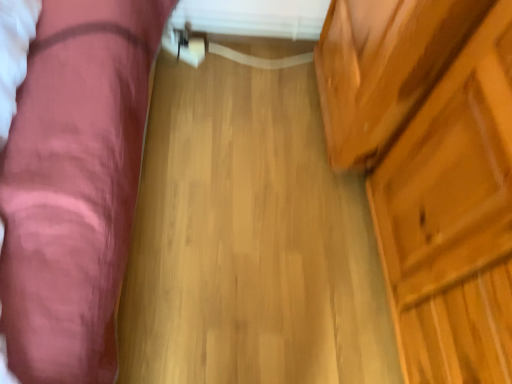
Question: Is point (292, 304) positioned closer to the camera than point (477, 130)?

Choices:
 (A) farther
 (B) closer

Answer: (A)

Question: From a real-world perspective, is natural wood floor at center positioned above or below wooden dresser at right?

Choices:
 (A) below
 (B) above

Answer: (A)

Question: Considering the real-world distances, which object is closest to the natural wood floor at center?

Choices:
 (A) wooden dresser at right
 (B) velvet pink couch at left

Answer: (A)

Question: Which of these objects is positioned farthest from the wooden dresser at right?

Choices:
 (A) velvet pink couch at left
 (B) natural wood floor at center

Answer: (A)